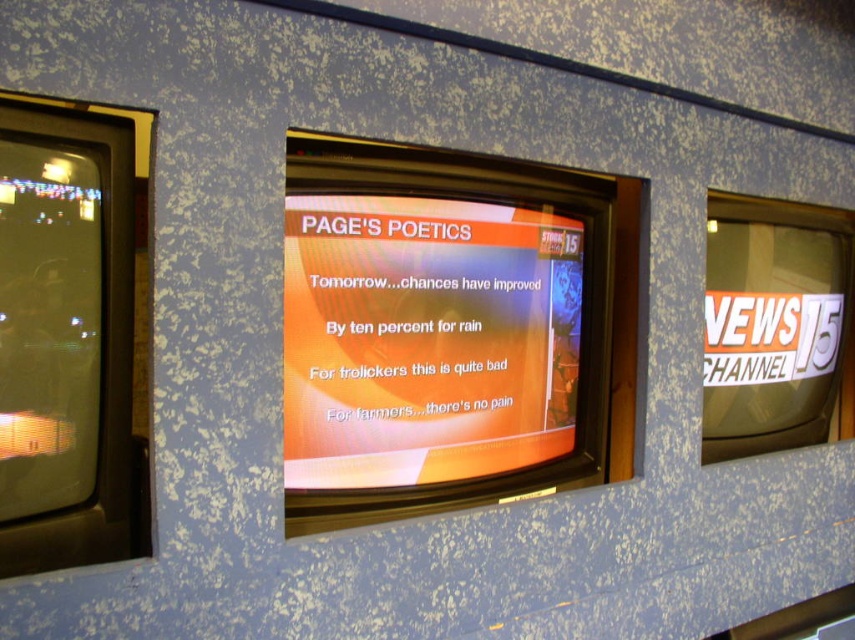
Question: Which point appears closest to the camera in this image?

Choices:
 (A) (0, 356)
 (B) (422, 300)

Answer: (A)

Question: From the image, what is the correct spatial relationship of orange glossy text at center in relation to matte black screen at left?

Choices:
 (A) left
 (B) right

Answer: (B)

Question: Can you confirm if orange glossy text at center is wider than matte black screen at left?

Choices:
 (A) yes
 (B) no

Answer: (A)

Question: Which point is closer to the camera?

Choices:
 (A) (89, 333)
 (B) (382, 420)

Answer: (A)

Question: Is orange glossy text at center wider than matte black screen at left?

Choices:
 (A) yes
 (B) no

Answer: (A)